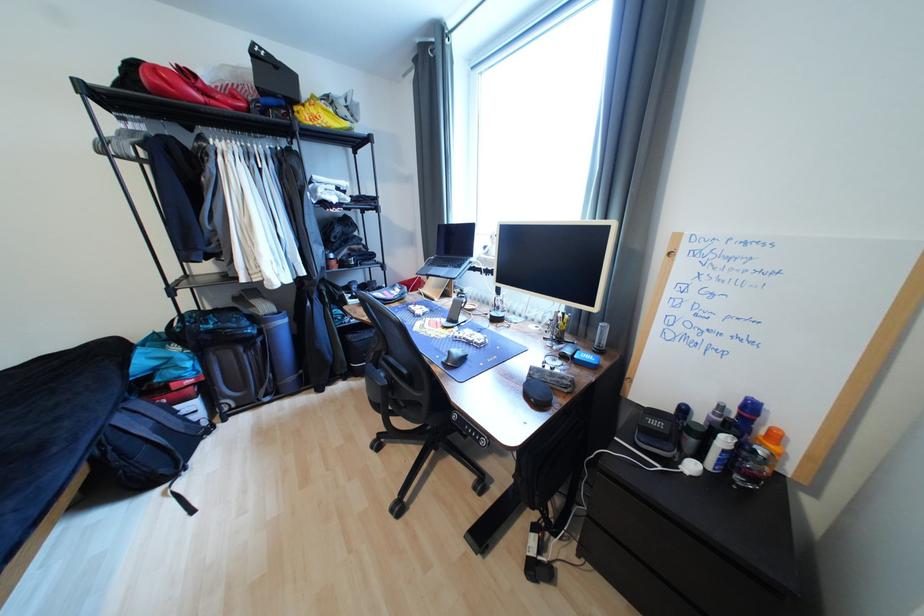
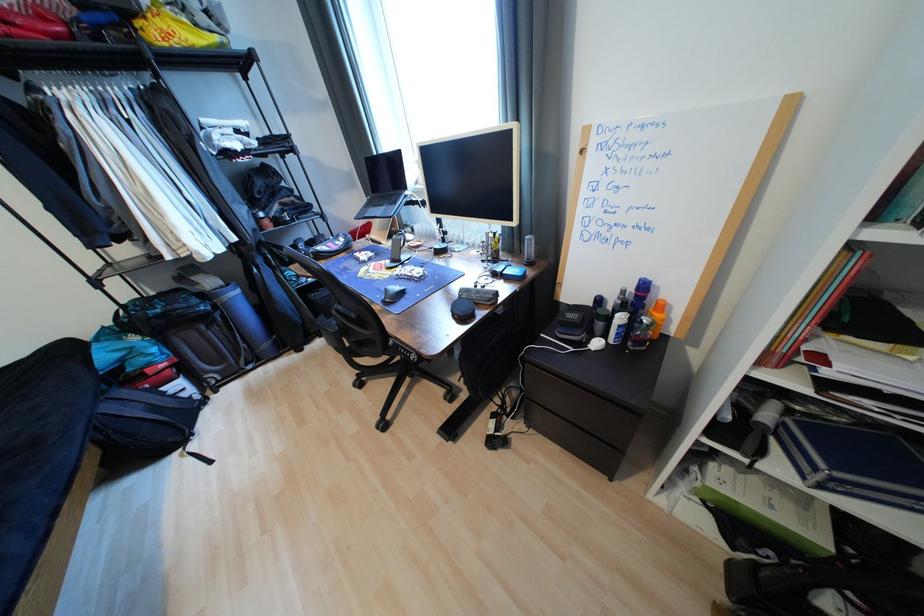
Where in the second image is the point corresponding to (456,354) from the first image?

(393, 292)